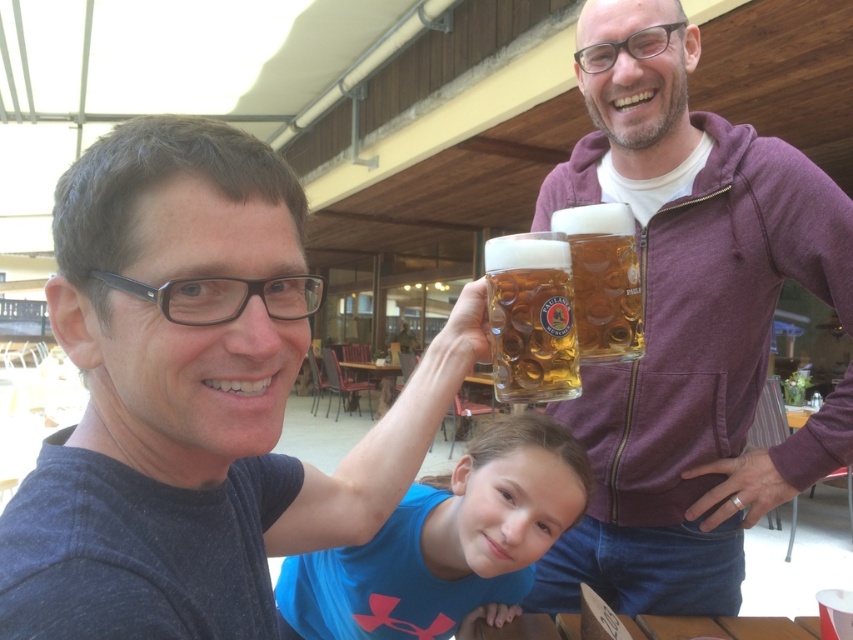
What is the color of the shirt worn by the person at the coordinates point (193, 397)?

The person at point (193, 397) is wearing a matte black shirt.

You are a delivery person who needs to place a small package between the matte purple hoodie at upper right and the translucent glass mug at upper center. The package is 12 inches long. Will it fit without overlapping either object?

The distance between the matte purple hoodie at upper right and the translucent glass mug at upper center is 15.77 inches. Since the package is 12 inches long, it will fit between them without overlapping as there is enough space.

You are standing in the beer garden and want to place a small potted plant between the two points labeled point (236, 467) and point (779, 260). Based on their positions, which point should the plant be closer to?

The plant should be placed closer to point (236, 467) because it is in front of point (779, 260).